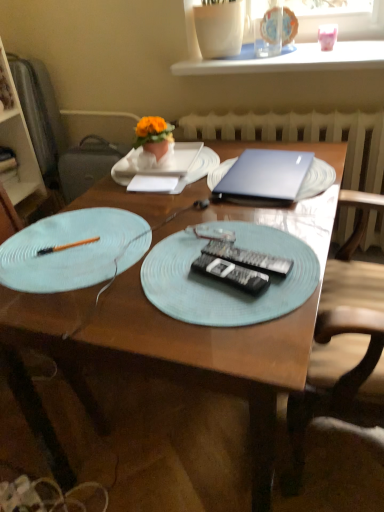
What are the coordinates of `vacant space situated above white paper plate at center, placed as the third plate when sorted from front to back (from a real-world perspective)` in the screenshot? It's located at (172, 164).